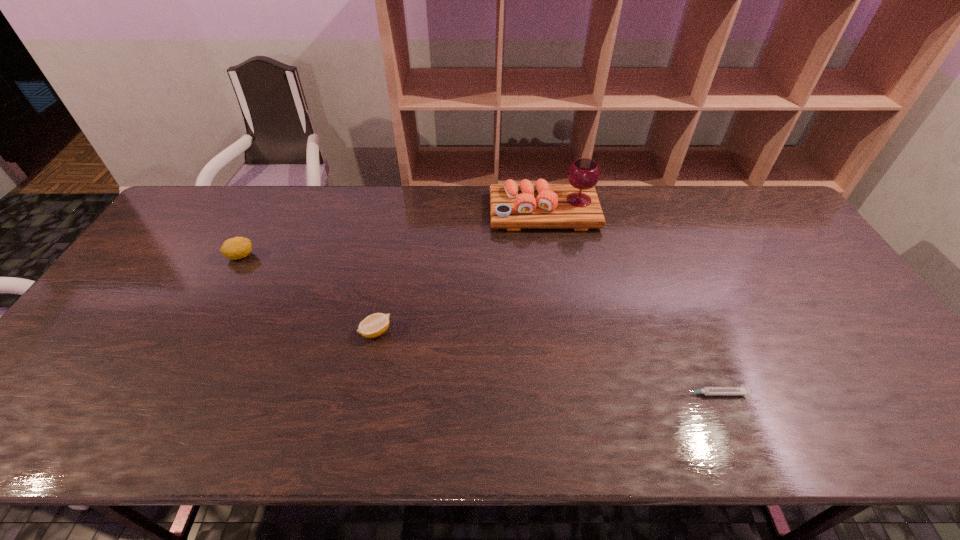
At what (x,y) coordinates should I click in order to perform the action: click on free space between the second object from left to right and the left lemon. Please return your answer as a coordinate pair (x, y). The width and height of the screenshot is (960, 540). Looking at the image, I should click on (308, 294).

The width and height of the screenshot is (960, 540). I want to click on free area in between the nearer lemon and the syringe, so click(x=544, y=363).

Locate an element on the screen. The width and height of the screenshot is (960, 540). free spot between the shortest object and the second object from right to left is located at coordinates (629, 303).

In order to click on free spot between the leftmost object and the rightmost object in this screenshot , I will do `click(477, 325)`.

You are a GUI agent. You are given a task and a screenshot of the screen. Output one action in this format:
    pyautogui.click(x=<x>, y=<y>)
    Task: Click on the free space between the third farthest object and the second tallest object
    The image size is (960, 540).
    Given the screenshot: What is the action you would take?
    pyautogui.click(x=308, y=294)

Find the location of `vacant space in between the farthest object and the left lemon`. vacant space in between the farthest object and the left lemon is located at coordinates (393, 234).

Locate an element on the screen. The image size is (960, 540). vacant region between the second object from right to left and the nearer lemon is located at coordinates (460, 272).

Identify the location of empty location between the left lemon and the nearest object. (477, 325).

You are a GUI agent. You are given a task and a screenshot of the screen. Output one action in this format:
    pyautogui.click(x=<x>, y=<y>)
    Task: Click on the free point between the third tallest object and the farthest object
    
    Given the screenshot: What is the action you would take?
    pyautogui.click(x=460, y=272)

Choose which object is the second nearest neighbor to the right lemon. Please provide its 2D coordinates. Your answer should be formatted as a tuple, i.e. [(x, y)], where the tuple contains the x and y coordinates of a point satisfying the conditions above.

[(576, 205)]